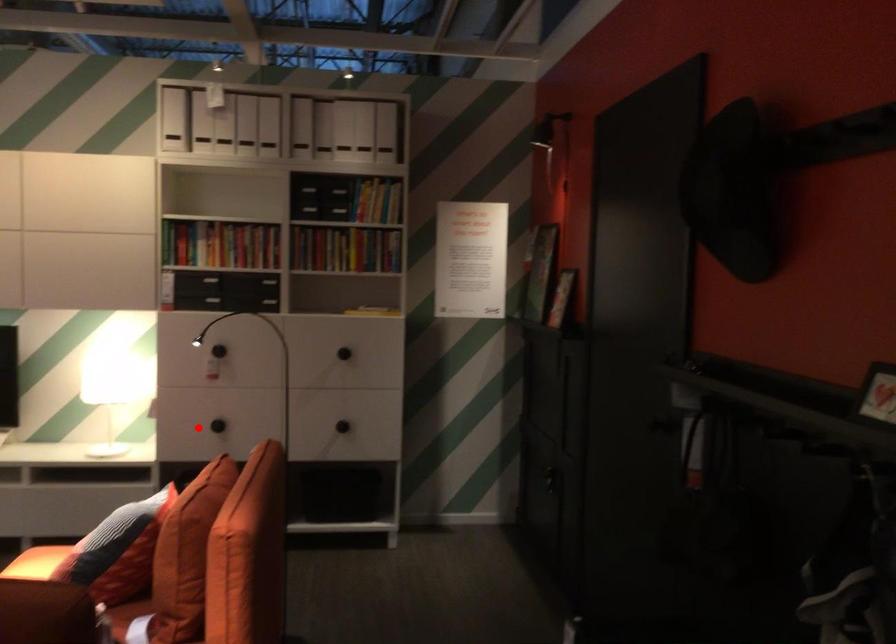
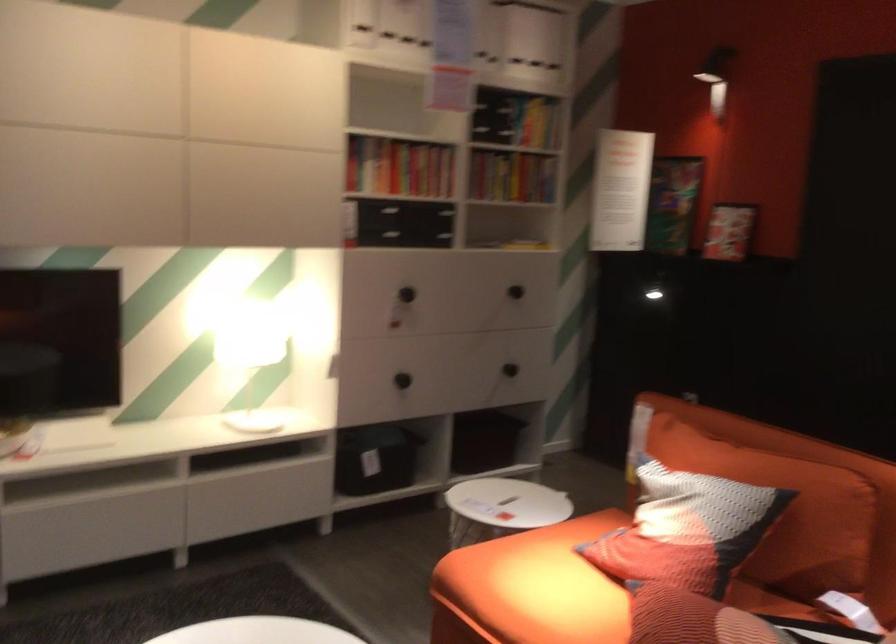
Find the pixel in the second image that matches the highlighted location in the first image.

(401, 380)